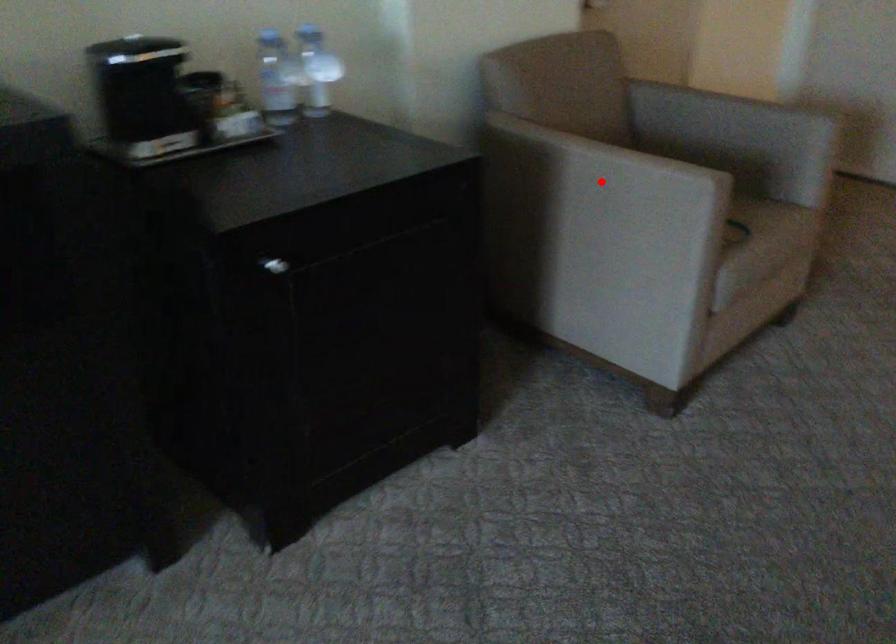
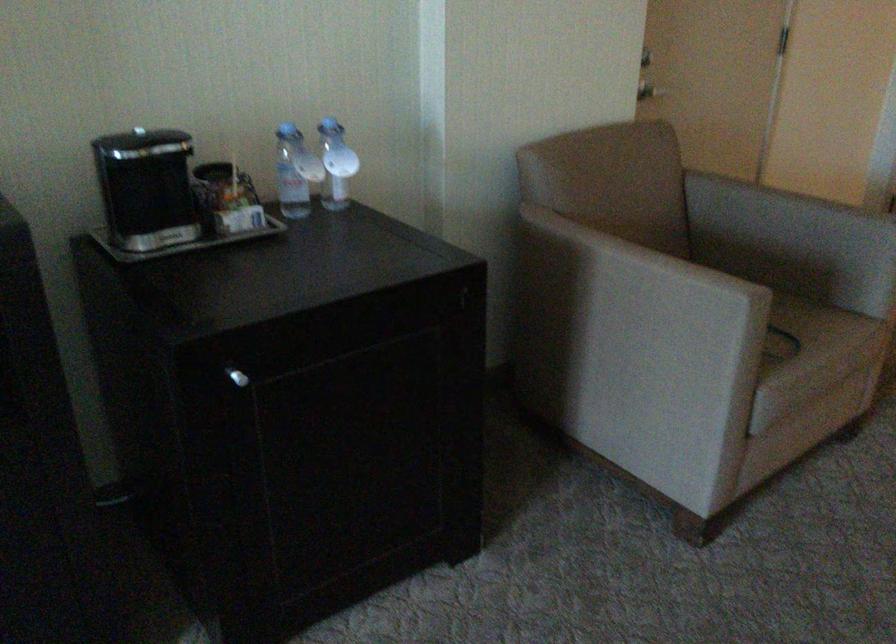
Locate, in the second image, the point that corresponds to the highlighted location in the first image.

(631, 283)